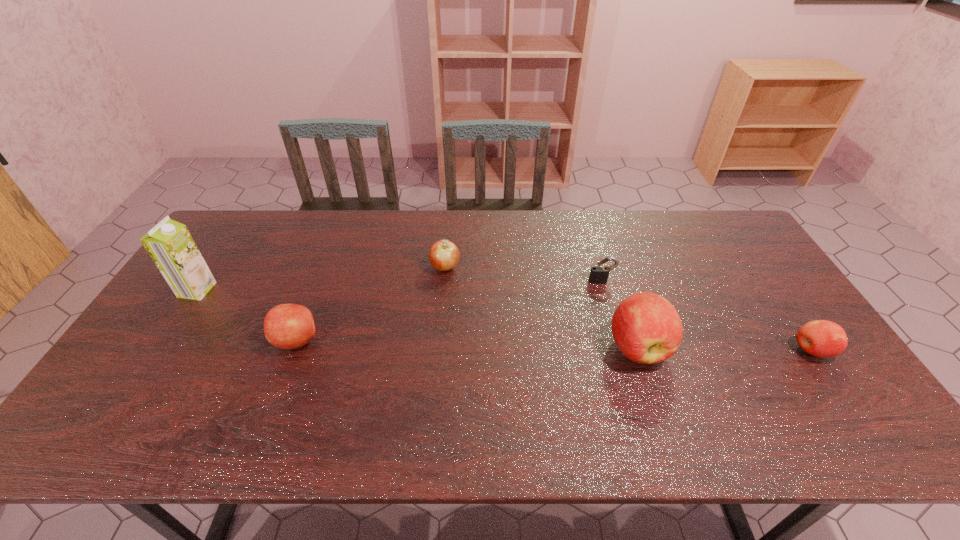
Image resolution: width=960 pixels, height=540 pixels. Find the location of `vacant spot for a new apple to ensure equal spacing`. vacant spot for a new apple to ensure equal spacing is located at coordinates (467, 344).